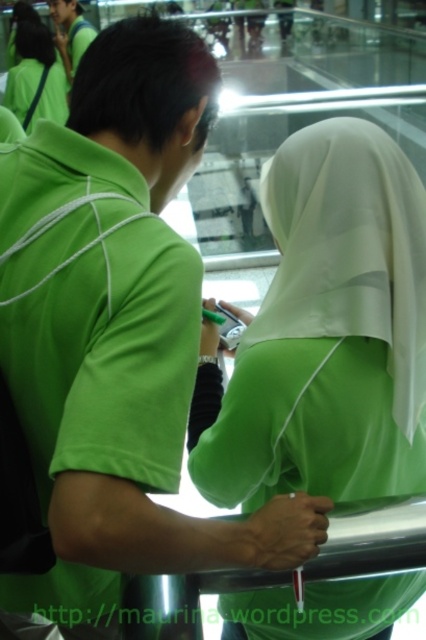
Question: Based on their relative distances, which object is nearer to the green satin hijab at center?

Choices:
 (A) matte green shirt at upper left
 (B) matte green hijab at upper left

Answer: (B)

Question: Which object appears closest to the camera in this image?

Choices:
 (A) matte green hijab at upper left
 (B) green satin hijab at center

Answer: (B)

Question: Is green satin hijab at center below matte green shirt at upper left?

Choices:
 (A) no
 (B) yes

Answer: (B)

Question: Among these objects, which one is farthest from the camera?

Choices:
 (A) matte green shirt at upper left
 (B) green satin hijab at center

Answer: (A)

Question: Can you confirm if green satin hijab at center is bigger than matte green hijab at upper left?

Choices:
 (A) yes
 (B) no

Answer: (B)

Question: Does green satin hijab at center have a lesser width compared to matte green hijab at upper left?

Choices:
 (A) no
 (B) yes

Answer: (B)